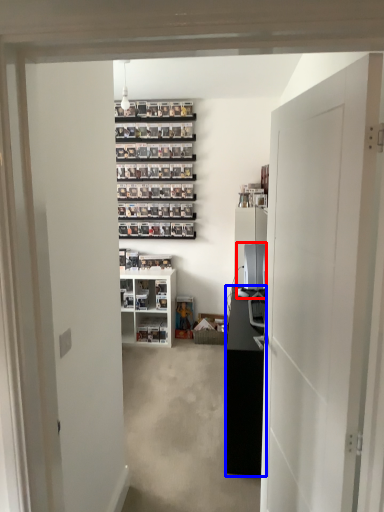
Question: Which object is further to the camera taking this photo, desktop computer (highlighted by a red box) or cabinetry (highlighted by a blue box)?

Choices:
 (A) desktop computer
 (B) cabinetry

Answer: (A)